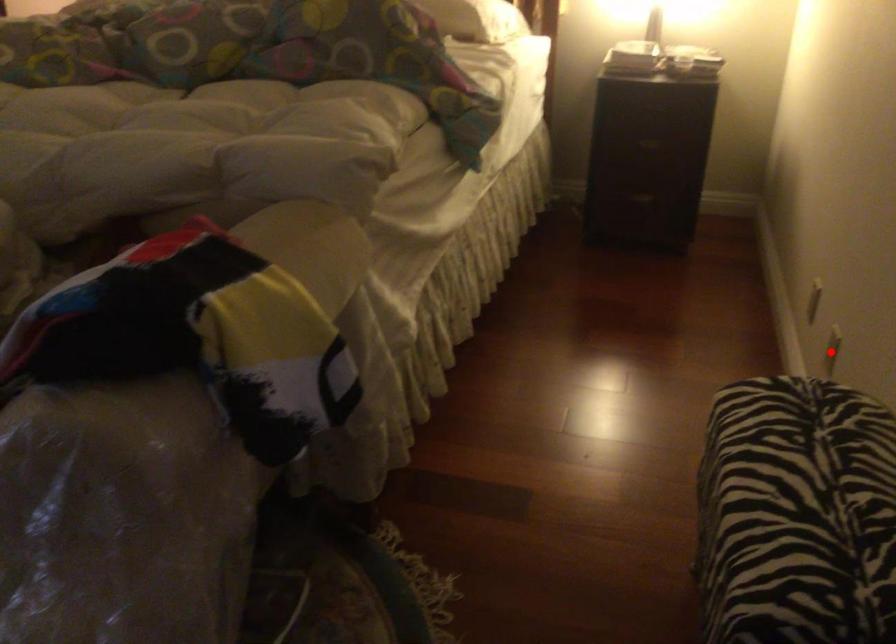
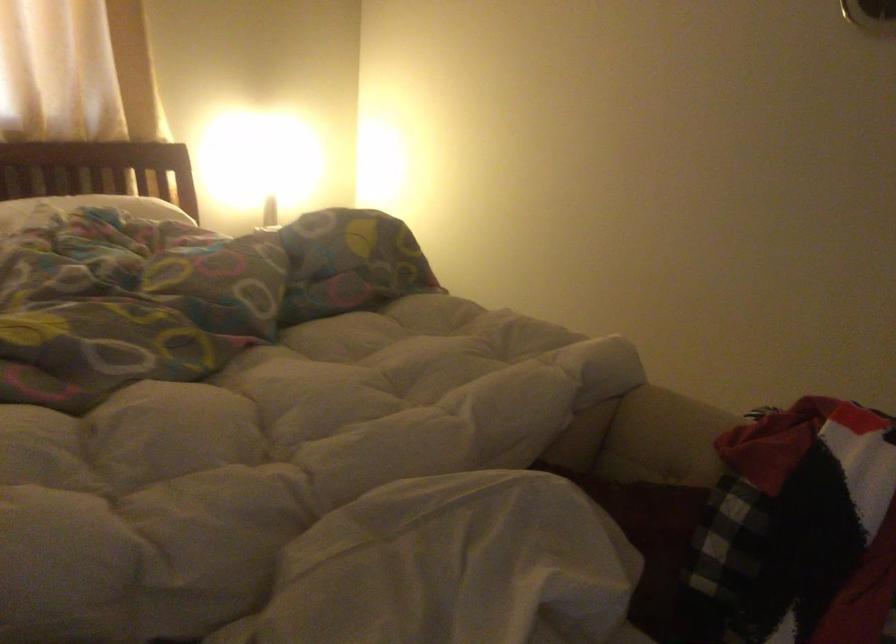
Question: I am providing you with two images of the same scene from different viewpoints. A red point is marked on the first image. Is the red point's position out of view in image 2?

Choices:
 (A) Yes
 (B) No

Answer: (A)